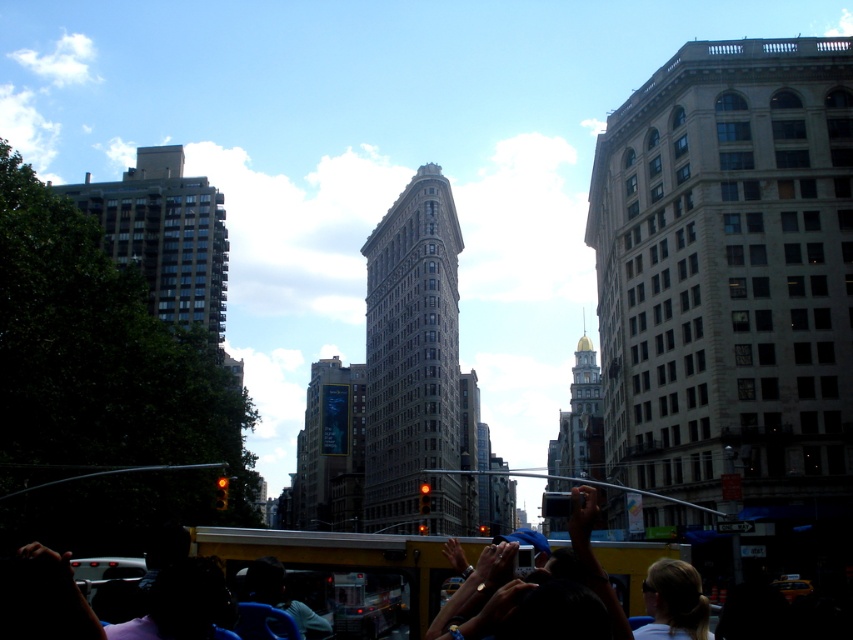
Is gray stone building at center in front of dark brown concrete building at left?

Yes.

Can you confirm if gray stone building at center is bigger than dark brown concrete building at left?

Yes.

Which is in front, point (376, 460) or point (157, 307)?

Point (157, 307)

Where is `gray stone building at center`? This screenshot has width=853, height=640. gray stone building at center is located at coordinates (413, 362).

Who is positioned more to the right, matte yellow bus at center or blue glass billboard at center?

Positioned to the right is matte yellow bus at center.

Is matte yellow bus at center thinner than blue glass billboard at center?

No, matte yellow bus at center is not thinner than blue glass billboard at center.

What do you see at coordinates (347, 556) in the screenshot?
I see `matte yellow bus at center` at bounding box center [347, 556].

Locate an element on the screen. Image resolution: width=853 pixels, height=640 pixels. matte yellow bus at center is located at coordinates (347, 556).

Can you confirm if dark brown concrete building at left is positioned below goldmaterial/texturetower at center?

No.

In the scene shown: Can you confirm if dark brown concrete building at left is positioned to the right of goldmaterial/texturetower at center?

No, dark brown concrete building at left is not to the right of goldmaterial/texturetower at center.

Does point (90, 212) come behind point (579, 392)?

No, (90, 212) is closer to viewer.

Identify the location of dark brown concrete building at left. This screenshot has width=853, height=640. (165, 236).